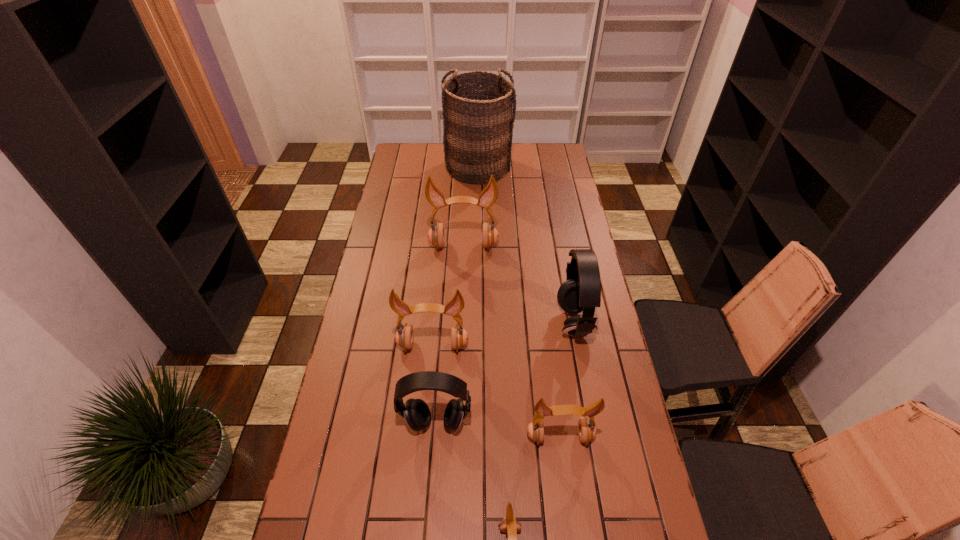
The height and width of the screenshot is (540, 960). In the image, there is a desktop. What are the coordinates of `free region at the far edge` in the screenshot? It's located at (436, 149).

The image size is (960, 540). What are the coordinates of `vacant area at the left edge of the desktop` in the screenshot? It's located at (407, 191).

Find the location of `vacant region at the right edge of the desktop`. vacant region at the right edge of the desktop is located at coordinates (543, 176).

At what (x,y) coordinates should I click in order to perform the action: click on free point at the far left corner. Please return your answer as a coordinate pair (x, y). This screenshot has height=540, width=960. Looking at the image, I should click on (412, 149).

In order to click on vacant point located between the second farthest brown earphone and the second smallest brown earphone in this screenshot , I will do `click(496, 391)`.

Locate an element on the screen. The image size is (960, 540). vacant area that lies between the second nearest brown earphone and the sixth shortest object is located at coordinates (512, 341).

Image resolution: width=960 pixels, height=540 pixels. Identify the location of vacant area that lies between the left black earphone and the farthest brown earphone. (449, 335).

Point out which object is positioned as the third nearest to the farthest earphone. Please provide its 2D coordinates. Your answer should be formatted as a tuple, i.e. [(x, y)], where the tuple contains the x and y coordinates of a point satisfying the conditions above.

[(404, 336)]

You are a GUI agent. You are given a task and a screenshot of the screen. Output one action in this format:
    pyautogui.click(x=<x>, y=<y>)
    Task: Click on the object that ranks as the second closest to the bigger black earphone
    The height and width of the screenshot is (540, 960).
    Given the screenshot: What is the action you would take?
    pyautogui.click(x=436, y=235)

The width and height of the screenshot is (960, 540). In order to click on earphone that stands as the second closest to the right black earphone in this screenshot , I will do `click(436, 235)`.